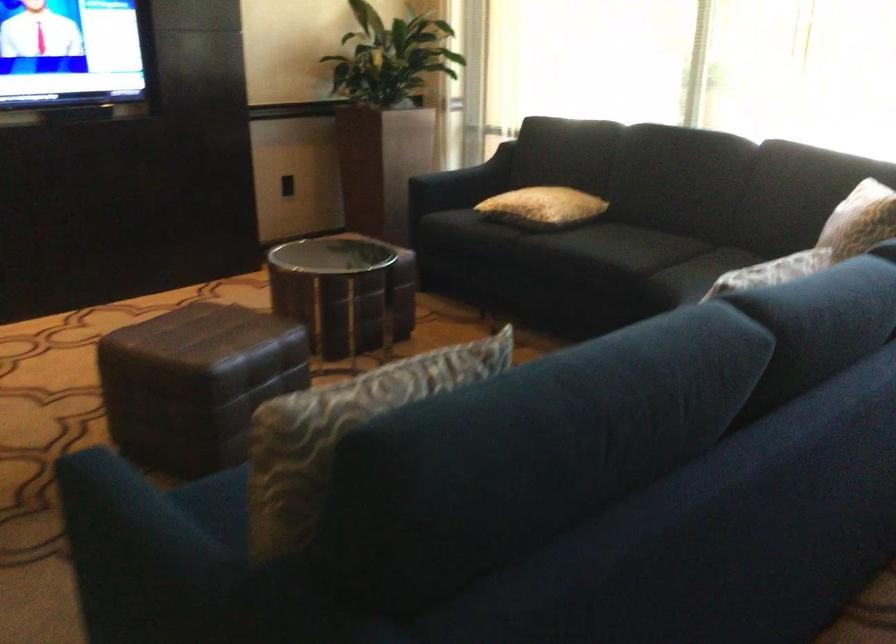
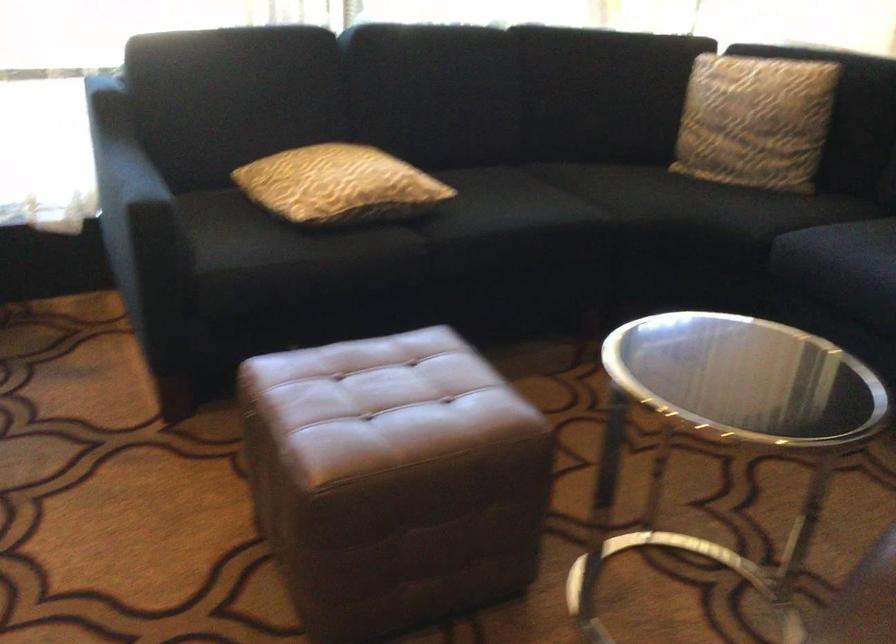
Where in the second image is the point corresponding to [512,198] from the first image?

(339, 185)